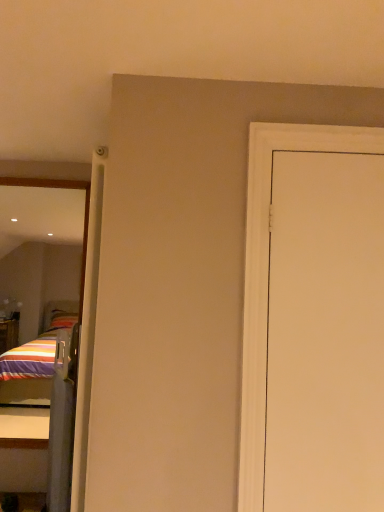
Question: From a real-world perspective, is white matte door at right located beneath reflective glass mirror at left?

Choices:
 (A) no
 (B) yes

Answer: (A)

Question: Would you consider white matte door at right to be distant from reflective glass mirror at left?

Choices:
 (A) no
 (B) yes

Answer: (A)

Question: Can you confirm if white matte door at right is taller than reflective glass mirror at left?

Choices:
 (A) yes
 (B) no

Answer: (B)

Question: From the image's perspective, is white matte door at right on top of reflective glass mirror at left?

Choices:
 (A) no
 (B) yes

Answer: (B)

Question: Considering the relative sizes of white matte door at right and reflective glass mirror at left in the image provided, is white matte door at right shorter than reflective glass mirror at left?

Choices:
 (A) yes
 (B) no

Answer: (A)

Question: Based on their positions, is reflective glass mirror at left located to the left or right of clear plastic screen door at left?

Choices:
 (A) left
 (B) right

Answer: (A)

Question: Is point (86, 233) positioned closer to the camera than point (54, 463)?

Choices:
 (A) closer
 (B) farther

Answer: (B)

Question: Considering the positions of reflective glass mirror at left and clear plastic screen door at left in the image, is reflective glass mirror at left taller or shorter than clear plastic screen door at left?

Choices:
 (A) short
 (B) tall

Answer: (B)

Question: Is reflective glass mirror at left situated inside clear plastic screen door at left or outside?

Choices:
 (A) outside
 (B) inside

Answer: (A)

Question: From a real-world perspective, is reflective glass mirror at left positioned above or below white matte door at right?

Choices:
 (A) above
 (B) below

Answer: (B)

Question: Is reflective glass mirror at left to the left or to the right of white matte door at right in the image?

Choices:
 (A) right
 (B) left

Answer: (B)

Question: In terms of width, does reflective glass mirror at left look wider or thinner when compared to white matte door at right?

Choices:
 (A) wide
 (B) thin

Answer: (B)

Question: Is reflective glass mirror at left spatially inside white matte door at right, or outside of it?

Choices:
 (A) outside
 (B) inside

Answer: (A)

Question: From a real-world perspective, is white matte door at right above or below reflective glass mirror at left?

Choices:
 (A) below
 (B) above

Answer: (B)

Question: In the image, is white matte door at right positioned in front of or behind reflective glass mirror at left?

Choices:
 (A) front
 (B) behind

Answer: (A)